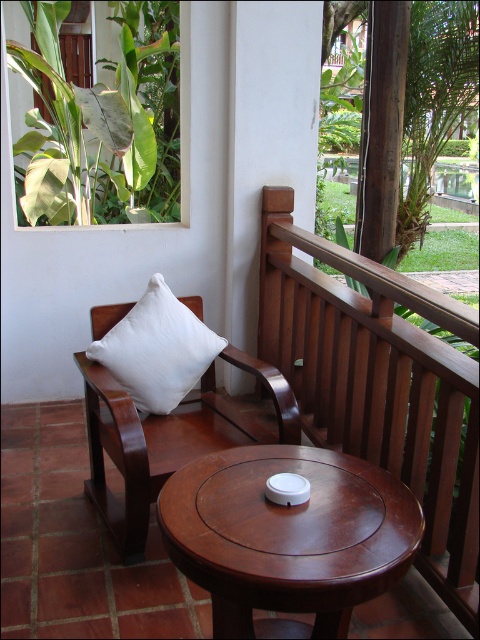
Question: Among these objects, which one is farthest from the camera?

Choices:
 (A) white cotton cushion at left
 (B) white matte cushion at upper left
 (C) mahogany wood round table at center

Answer: (A)

Question: Which object is closer to the camera taking this photo?

Choices:
 (A) brown wooden balustrade at upper right
 (B) green leafy plant at upper left
 (C) mahogany wood round table at center

Answer: (C)

Question: Can you confirm if brown wooden balustrade at upper right is positioned to the right of mahogany wood round table at center?

Choices:
 (A) no
 (B) yes

Answer: (B)

Question: Is mahogany wood round table at center further to the viewer compared to white cotton cushion at left?

Choices:
 (A) yes
 (B) no

Answer: (B)

Question: Which point is closer to the camera taking this photo?

Choices:
 (A) (409, 388)
 (B) (147, 291)
 (C) (179, 211)
 (D) (225, 426)

Answer: (A)

Question: Is mahogany wood round table at center smaller than white matte cushion at upper left?

Choices:
 (A) no
 (B) yes

Answer: (B)